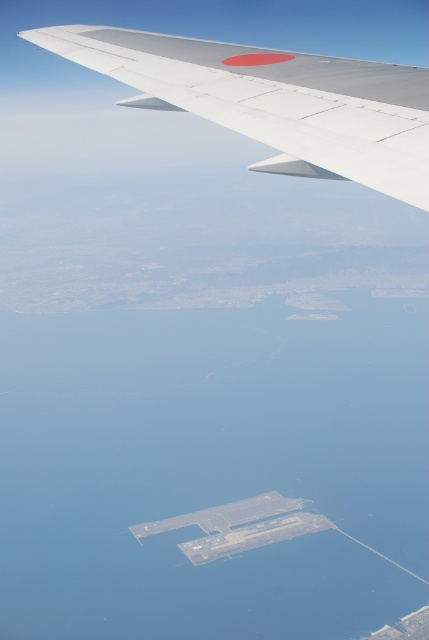
Question: Where is transparent water at center located in relation to metallic gray wing at upper left in the image?

Choices:
 (A) below
 (B) above

Answer: (A)

Question: Can you confirm if transparent water at center is smaller than metallic gray wing at upper left?

Choices:
 (A) no
 (B) yes

Answer: (A)

Question: Is transparent water at center below metallic gray wing at upper left?

Choices:
 (A) yes
 (B) no

Answer: (A)

Question: Which point is closer to the camera?

Choices:
 (A) (317, 632)
 (B) (347, 99)

Answer: (B)